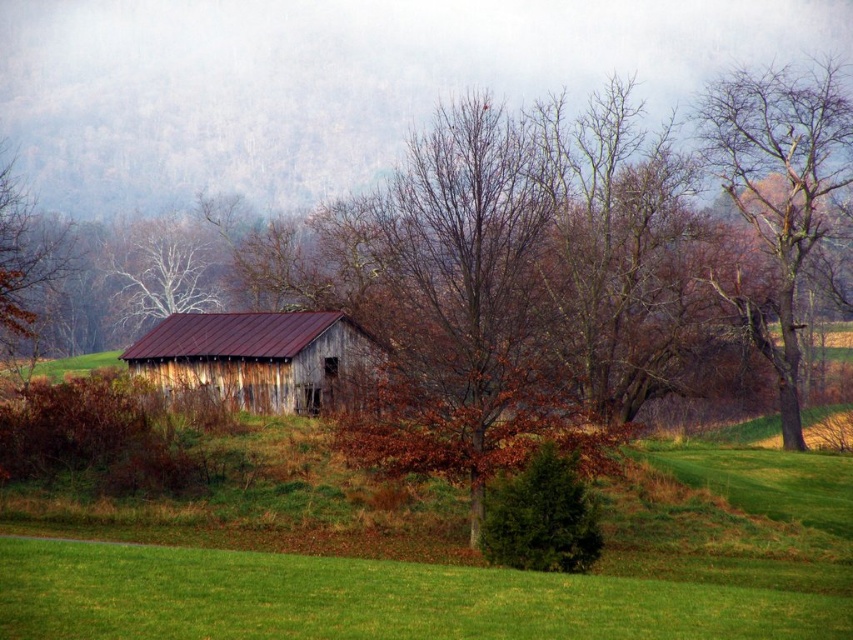
Does bare wood tree at upper right have a larger size compared to weathered wood barn at center?

Correct, bare wood tree at upper right is larger in size than weathered wood barn at center.

I want to click on bare wood tree at upper right, so click(779, 188).